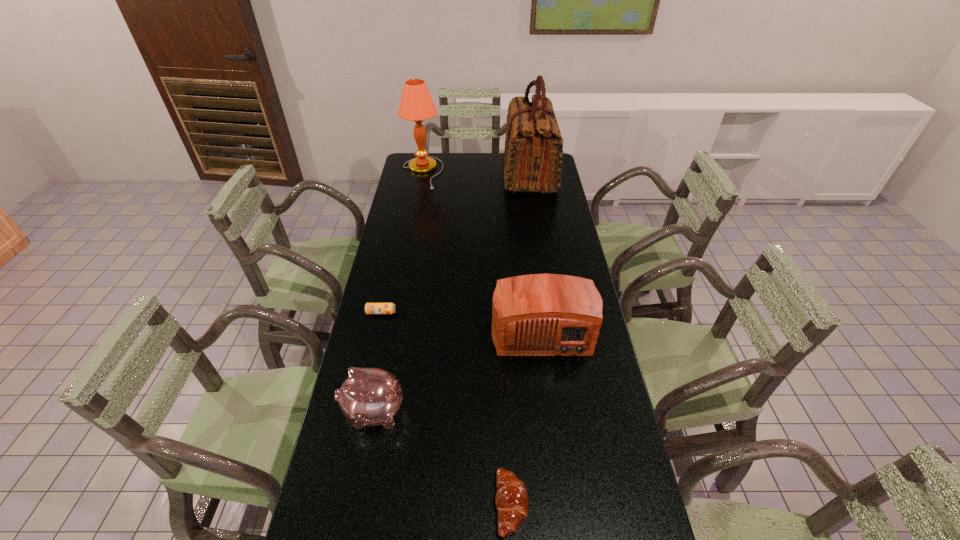
Locate an element on the screen. The image size is (960, 540). shopping bag is located at coordinates coord(533,149).

At what (x,y) coordinates should I click in order to perform the action: click on lamp. Please return your answer as a coordinate pair (x, y). The width and height of the screenshot is (960, 540). Looking at the image, I should click on click(416, 104).

You are a GUI agent. You are given a task and a screenshot of the screen. Output one action in this format:
    pyautogui.click(x=<x>, y=<y>)
    Task: Click on the radio receiver
    The width and height of the screenshot is (960, 540).
    Given the screenshot: What is the action you would take?
    pyautogui.click(x=537, y=314)

Locate an element on the screen. This screenshot has height=540, width=960. the third shortest object is located at coordinates (370, 396).

Image resolution: width=960 pixels, height=540 pixels. What are the coordinates of `the second nearest object` in the screenshot? It's located at (370, 396).

You are a GUI agent. You are given a task and a screenshot of the screen. Output one action in this format:
    pyautogui.click(x=<x>, y=<y>)
    Task: Click on the shortest object
    This screenshot has width=960, height=540.
    Given the screenshot: What is the action you would take?
    pyautogui.click(x=370, y=308)

What are the coordinates of `vacant space located 0.360m on the open handle side of the shopping bag` in the screenshot? It's located at (425, 173).

I want to click on vacant area located on the open handle side of the shopping bag, so click(x=441, y=173).

Locate an element on the screen. free space located 0.190m on the open handle side of the shopping bag is located at coordinates (462, 173).

Find the location of a particular element. free space located 0.090m on the right of the lamp is located at coordinates (462, 173).